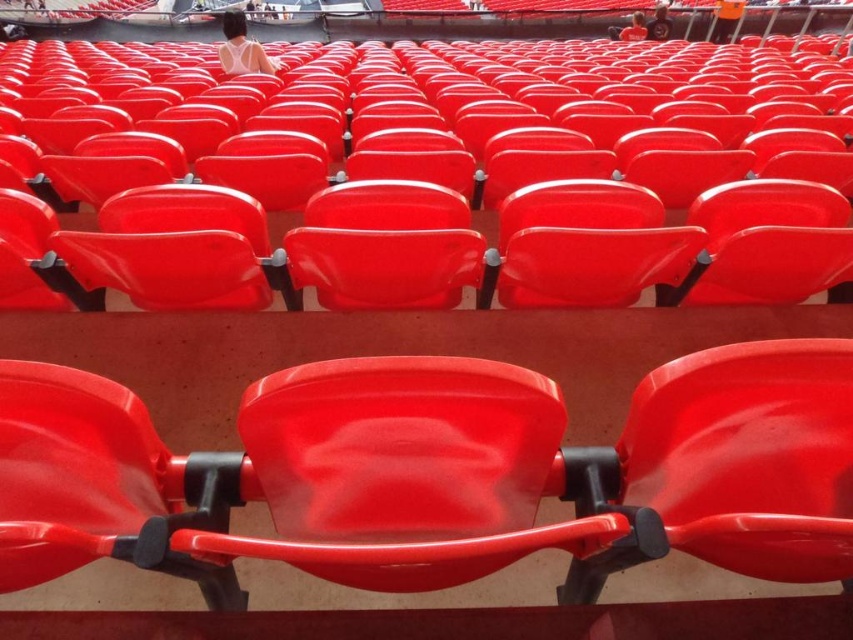
Is matte plastic seat at center below matte white tank top at upper center?

Yes, matte plastic seat at center is below matte white tank top at upper center.

Is matte plastic seat at center further to the viewer compared to matte white tank top at upper center?

No, matte plastic seat at center is closer to the viewer.

Does point (497, 132) lie in front of point (254, 52)?

Yes.

The height and width of the screenshot is (640, 853). What are the coordinates of `matte plastic seat at center` in the screenshot? It's located at (437, 179).

Find the location of a particular element. Image resolution: width=853 pixels, height=640 pixels. matte plastic seat at center is located at coordinates (437, 179).

The width and height of the screenshot is (853, 640). I want to click on matte plastic seat at center, so click(x=437, y=179).

Between point (227, 12) and point (618, 38), which one is positioned behind?

Positioned behind is point (618, 38).

From the picture: Who is positioned more to the right, matte white tank top at upper center or matte white shirt at upper center?

matte white shirt at upper center

Where is `matte white tank top at upper center`? matte white tank top at upper center is located at coordinates (241, 49).